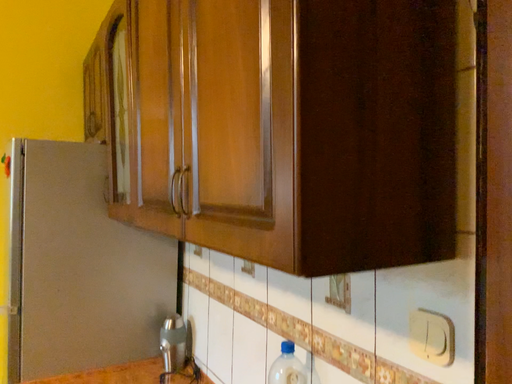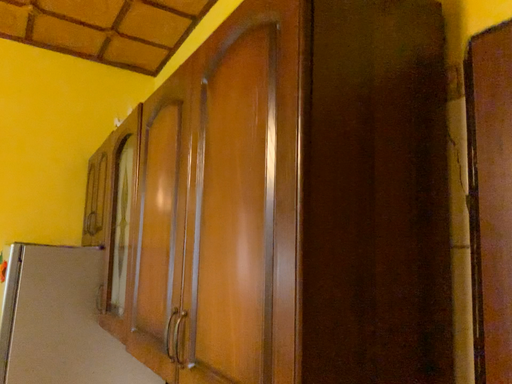
Question: Which way did the camera rotate in the video?

Choices:
 (A) rotated upward
 (B) rotated downward

Answer: (A)